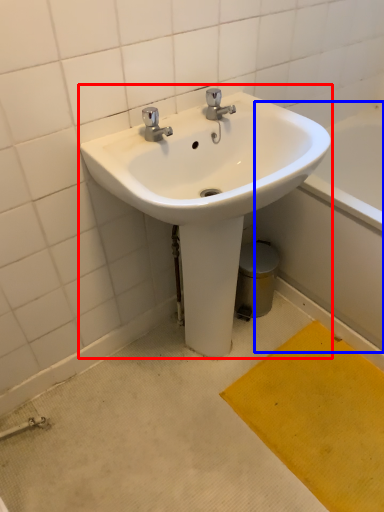
Question: Which object appears closest to the camera in this image, sink (highlighted by a red box) or bath (highlighted by a blue box)?

Choices:
 (A) sink
 (B) bath

Answer: (A)